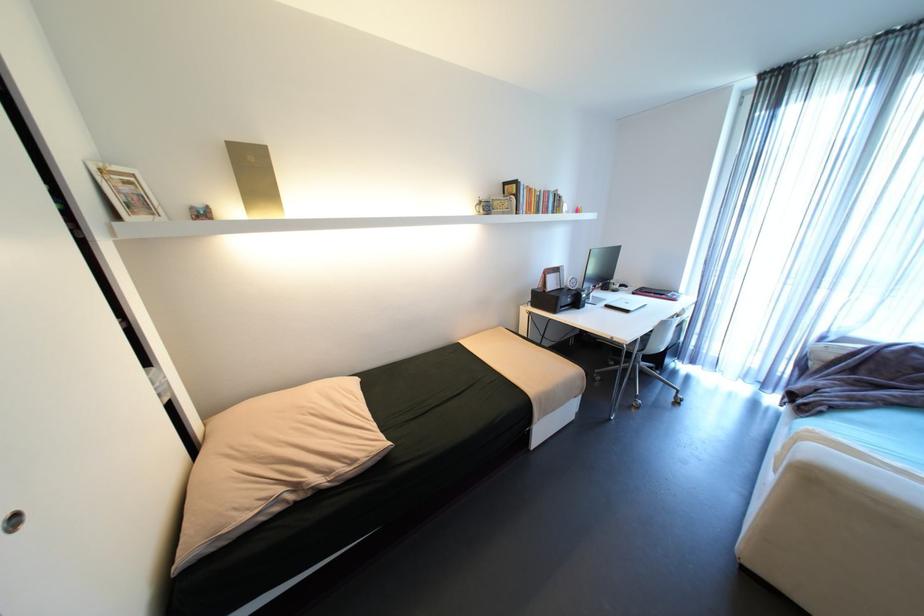
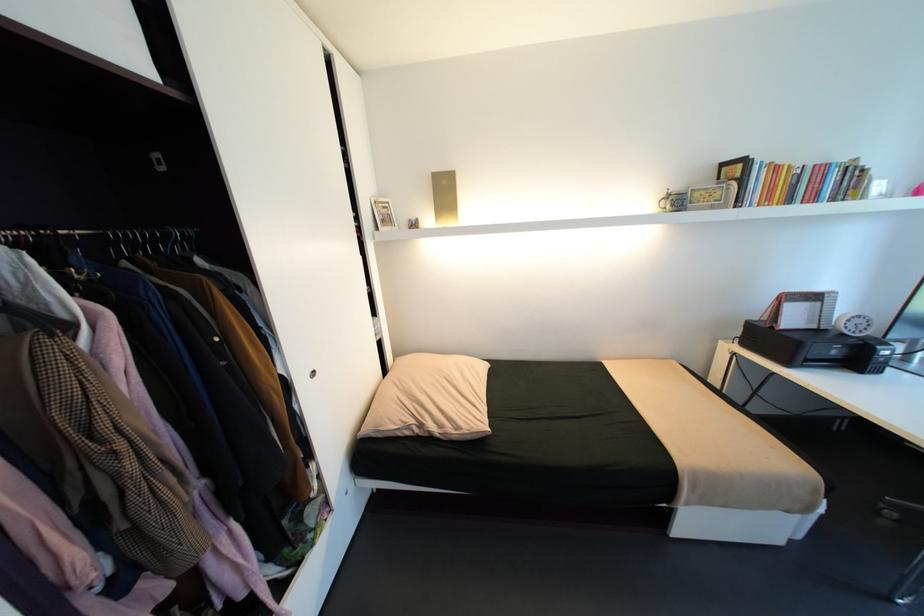
In the second image, find the point that corresponds to the point at 552,292 in the first image.

(779, 328)